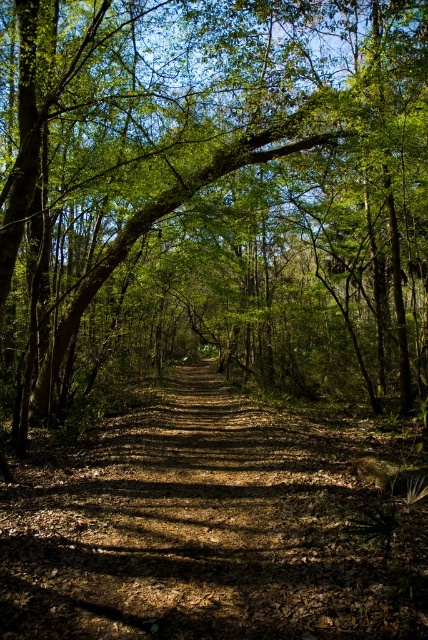
Who is positioned more to the left, green leafy tree at center or brown dirt trail at center?

green leafy tree at center is more to the left.

Does point (335, 236) come behind point (347, 544)?

Yes, point (335, 236) is farther from viewer.

You are a GUI agent. You are given a task and a screenshot of the screen. Output one action in this format:
    pyautogui.click(x=<x>, y=<y>)
    Task: Click on the green leafy tree at center
    Image resolution: width=428 pixels, height=640 pixels.
    Given the screenshot: What is the action you would take?
    pyautogui.click(x=211, y=196)